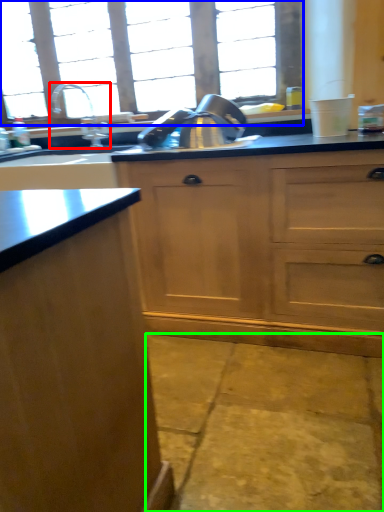
Question: Which object is positioned farthest from tap (highlighted by a red box)? Select from window (highlighted by a blue box) and concrete (highlighted by a green box).

Choices:
 (A) window
 (B) concrete

Answer: (B)